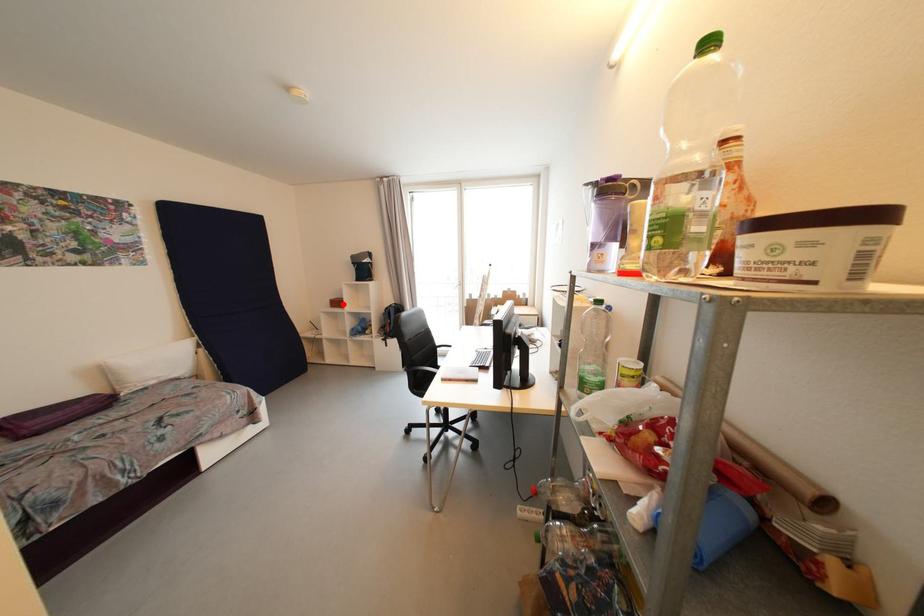
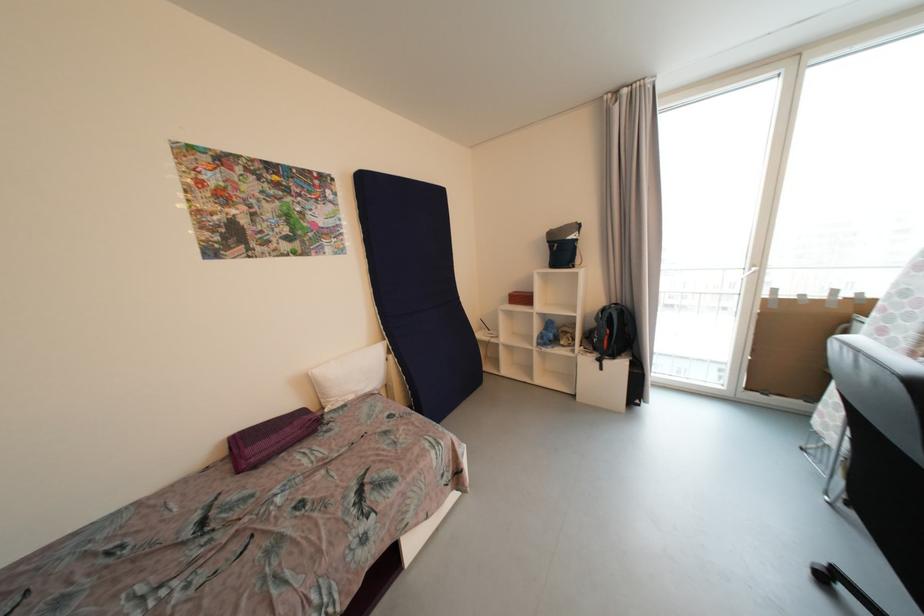
The point at the highlighted location is marked in the first image. Where is the corresponding point in the second image?

(528, 300)